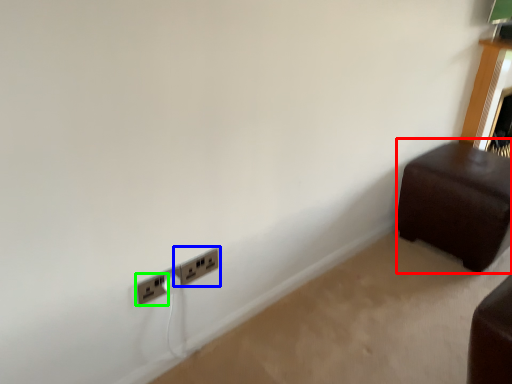
Question: Based on their relative distances, which object is farther from furniture (highlighted by a red box)? Choose from power plugs and sockets (highlighted by a blue box) and power plugs and sockets (highlighted by a green box).

Choices:
 (A) power plugs and sockets
 (B) power plugs and sockets

Answer: (B)